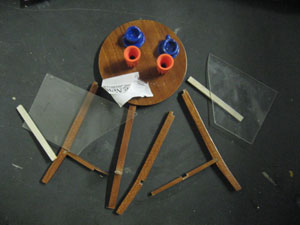
The width and height of the screenshot is (300, 225). Identify the location of middle of brown coaster. (143, 61).